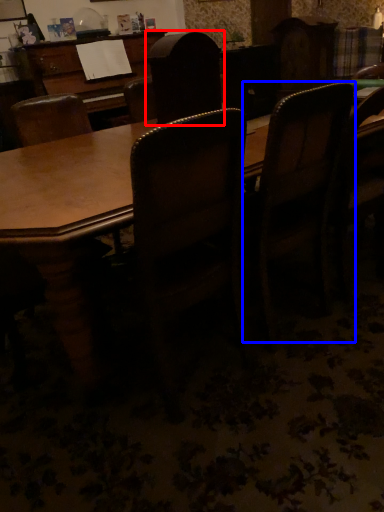
Question: Which point is closer to the camera, chair (highlighted by a red box) or chair (highlighted by a blue box)?

Choices:
 (A) chair
 (B) chair

Answer: (B)